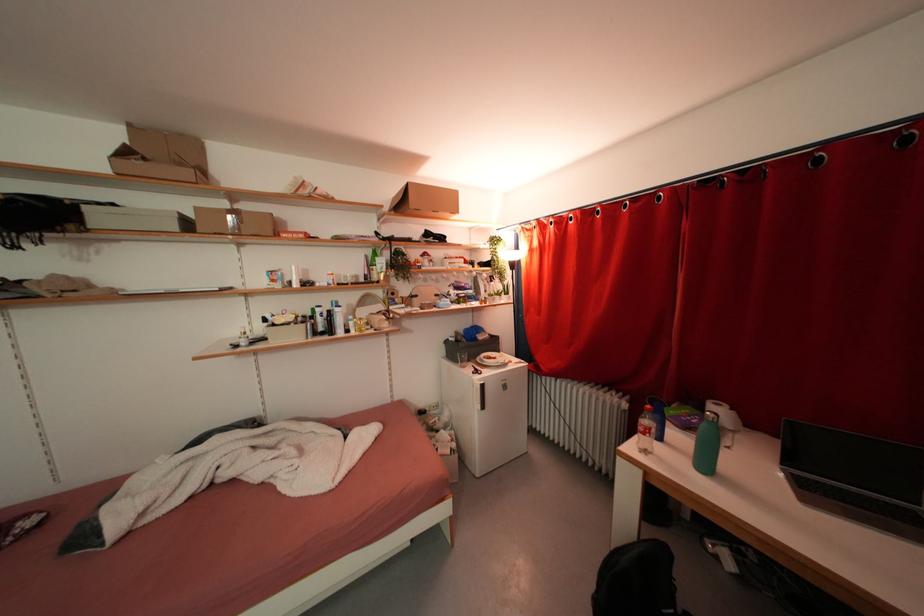
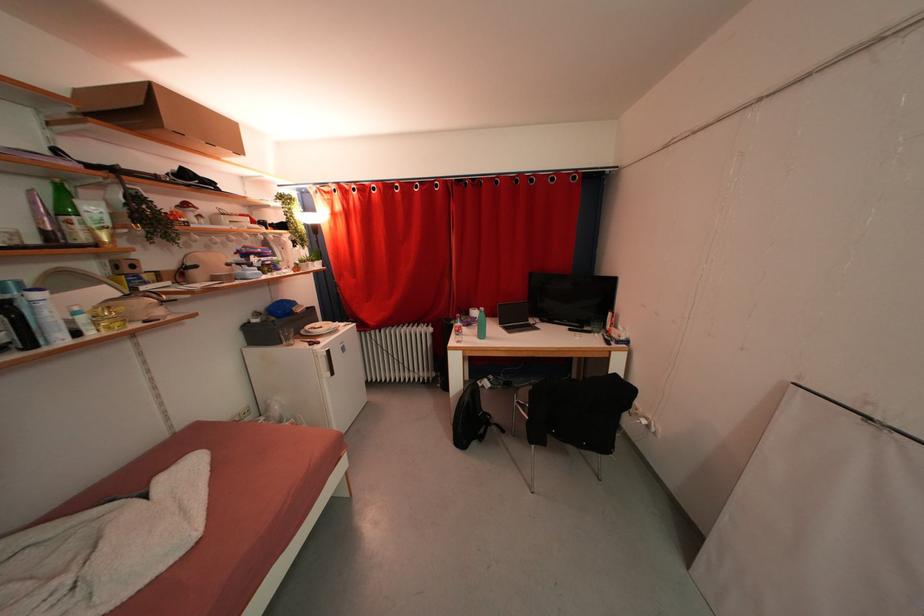
Locate, in the second image, the point that corresponds to pixel 482 379 in the first image.

(322, 351)